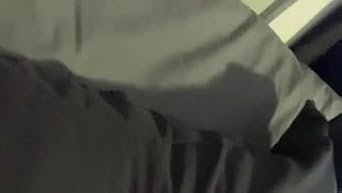
The image size is (342, 193). I want to click on window, so click(292, 13).